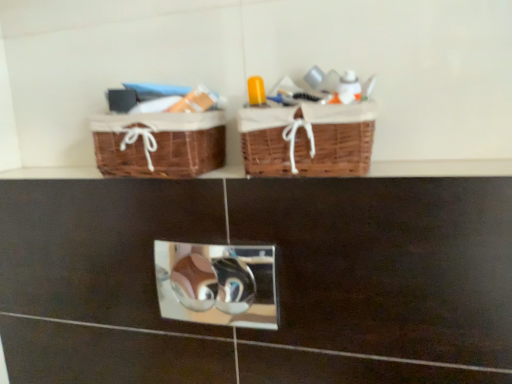
Question: Does metallic reflective mirror at center have a lesser width compared to brown wicker baskets at upper center?

Choices:
 (A) no
 (B) yes

Answer: (B)

Question: Is the depth of metallic reflective mirror at center greater than that of brown wicker baskets at upper center?

Choices:
 (A) no
 (B) yes

Answer: (B)

Question: Does metallic reflective mirror at center have a greater width compared to brown wicker baskets at upper center?

Choices:
 (A) yes
 (B) no

Answer: (B)

Question: Is metallic reflective mirror at center outside of brown wicker baskets at upper center?

Choices:
 (A) no
 (B) yes

Answer: (B)

Question: Does metallic reflective mirror at center have a larger size compared to brown wicker baskets at upper center?

Choices:
 (A) no
 (B) yes

Answer: (B)

Question: From the image's perspective, is metallic reflective mirror at center on top of brown wicker baskets at upper center?

Choices:
 (A) yes
 (B) no

Answer: (B)

Question: Is metallic reflective mirror at center to the left of woven brown picnic basket at upper center, which is the 2th picnic basket from left to right, from the viewer's perspective?

Choices:
 (A) no
 (B) yes

Answer: (B)

Question: From the image's perspective, is metallic reflective mirror at center above woven brown picnic basket at upper center, arranged as the first picnic basket when viewed from the right?

Choices:
 (A) no
 (B) yes

Answer: (A)

Question: Is metallic reflective mirror at center oriented away from woven brown picnic basket at upper center, which is the 2th picnic basket from left to right?

Choices:
 (A) no
 (B) yes

Answer: (A)

Question: Is metallic reflective mirror at center oriented towards woven brown picnic basket at upper center, which is the 2th picnic basket from left to right?

Choices:
 (A) yes
 (B) no

Answer: (B)

Question: Is metallic reflective mirror at center outside woven brown picnic basket at upper center, arranged as the first picnic basket when viewed from the right?

Choices:
 (A) yes
 (B) no

Answer: (A)

Question: Is metallic reflective mirror at center at the right side of woven brown picnic basket at upper center, arranged as the first picnic basket when viewed from the right?

Choices:
 (A) no
 (B) yes

Answer: (A)

Question: Does metallic reflective mirror at center turn towards brown woven picnic basket at left, which is the 2th picnic basket in right-to-left order?

Choices:
 (A) no
 (B) yes

Answer: (A)